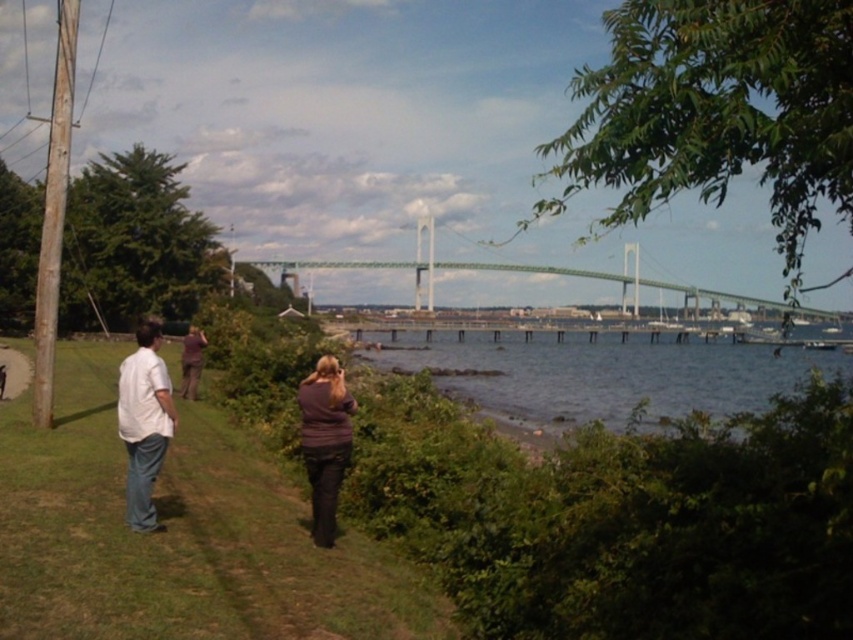
Question: Which point is closer to the camera taking this photo?

Choices:
 (A) (496, 378)
 (B) (155, 474)
 (C) (323, 506)

Answer: (B)

Question: Is white cotton shirt at lower left bigger than dark purple sweater at center?

Choices:
 (A) no
 (B) yes

Answer: (B)

Question: Which object is farther from the camera taking this photo?

Choices:
 (A) white matte shirt at left
 (B) green water at lower center
 (C) white cotton shirt at lower left
 (D) dark purple sweater at center

Answer: (D)

Question: Based on their relative distances, which object is nearer to the green water at lower center?

Choices:
 (A) white matte shirt at left
 (B) white cotton shirt at lower left

Answer: (B)

Question: In this image, where is white cotton shirt at lower left located relative to green metallic bridge at center?

Choices:
 (A) below
 (B) above

Answer: (A)

Question: Does green water at lower center have a smaller size compared to dark purple sweater at center?

Choices:
 (A) no
 (B) yes

Answer: (A)